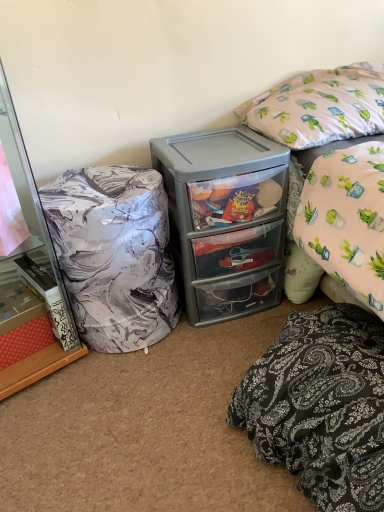
At what (x,y) coordinates should I click in order to perform the action: click on free area in between marble-patterned bean bag at left and black paisley pillow at lower right, the 2th pillow when ordered from top to bottom. Please return your answer as a coordinate pair (x, y). The width and height of the screenshot is (384, 512). Looking at the image, I should click on (188, 388).